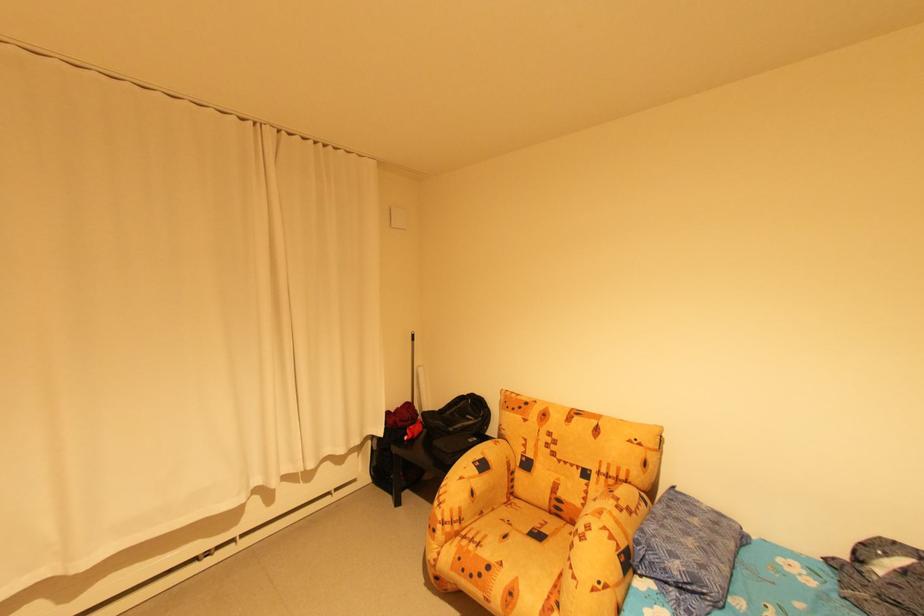
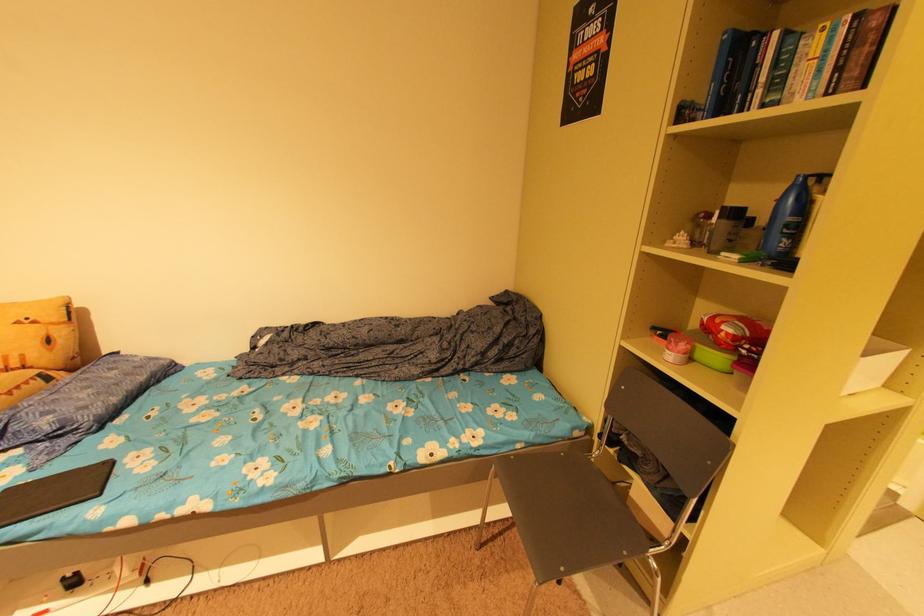
The point at (637, 442) is marked in the first image. Where is the corresponding point in the second image?

(23, 323)